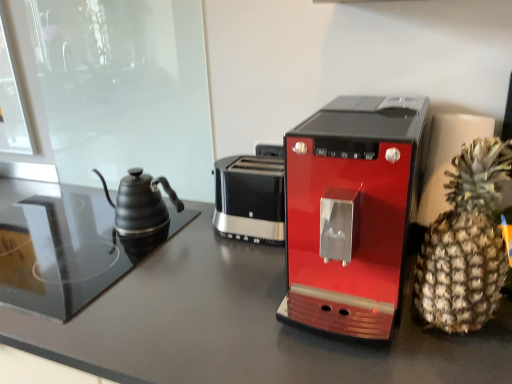
Describe the element at coordinates (251, 196) in the screenshot. I see `black plastic toaster at center` at that location.

What is the approximate height of brown spiky pineapple at right?

brown spiky pineapple at right is 32.21 centimeters in height.

The width and height of the screenshot is (512, 384). Describe the element at coordinates (465, 243) in the screenshot. I see `brown spiky pineapple at right` at that location.

Locate an element on the screen. The width and height of the screenshot is (512, 384). matte black table at center is located at coordinates (241, 327).

Where is `black plastic toaster at center`? black plastic toaster at center is located at coordinates (251, 196).

Considering the relative sizes of black plastic toaster at center and brown spiky pineapple at right in the image provided, is black plastic toaster at center shorter than brown spiky pineapple at right?

Yes, black plastic toaster at center is shorter than brown spiky pineapple at right.

From the image's perspective, which one is positioned lower, black plastic toaster at center or brown spiky pineapple at right?

From the image's view, brown spiky pineapple at right is below.

Which object is closer to the camera taking this photo, black plastic toaster at center or brown spiky pineapple at right?

brown spiky pineapple at right is closer to the camera.

From a real-world perspective, is black plastic toaster at center physically located above or below brown spiky pineapple at right?

In terms of real-world spatial position, black plastic toaster at center is below brown spiky pineapple at right.

Considering the sizes of objects matte black table at center and matte black kettle at left in the image provided, who is thinner, matte black table at center or matte black kettle at left?

matte black kettle at left.

From the image's perspective, relative to matte black kettle at left, is matte black table at center above or below?

From the image's perspective, matte black table at center appears below matte black kettle at left.

Which is more to the right, matte black table at center or matte black kettle at left?

From the viewer's perspective, matte black kettle at left appears more on the right side.

Can you tell me how much matte black table at center and matte black kettle at left differ in facing direction?

There is a 1.02-degree angle between the facing directions of matte black table at center and matte black kettle at left.

Is matte black table at center directly adjacent to shiny red coffee maker at center?

matte black table at center and shiny red coffee maker at center are clearly separated.

Considering the relative sizes of matte black table at center and shiny red coffee maker at center in the image provided, is matte black table at center wider than shiny red coffee maker at center?

Correct, the width of matte black table at center exceeds that of shiny red coffee maker at center.

Is matte black table at center positioned with its back to shiny red coffee maker at center?

No, matte black table at center is not facing away from shiny red coffee maker at center.

From the image's perspective, which is below, matte black table at center or shiny red coffee maker at center?

From the image's view, matte black table at center is below.

From a real-world perspective, does black plastic toaster at center sit lower than shiny red coffee maker at center?

Indeed, from a real-world perspective, black plastic toaster at center is positioned beneath shiny red coffee maker at center.

What are the coordinates of `toaster behind the shiny red coffee maker at center` in the screenshot? It's located at (251, 196).

In the image, is black plastic toaster at center positioned in front of or behind shiny red coffee maker at center?

Clearly, black plastic toaster at center is behind shiny red coffee maker at center.

Is shiny red coffee maker at center looking in the opposite direction of brown spiky pineapple at right?

No, brown spiky pineapple at right is not at the back of shiny red coffee maker at center.

Which of these two, shiny red coffee maker at center or brown spiky pineapple at right, is thinner?

Thinner between the two is brown spiky pineapple at right.

Would you say brown spiky pineapple at right is part of shiny red coffee maker at center's contents?

No, brown spiky pineapple at right is located outside of shiny red coffee maker at center.

Does matte black table at center come in front of black plastic toaster at center?

Yes.

From a real-world perspective, relative to black plastic toaster at center, is matte black table at center vertically above or below?

In terms of real-world spatial position, matte black table at center is below black plastic toaster at center.

Is matte black table at center to the left or to the right of black plastic toaster at center in the image?

matte black table at center is positioned on black plastic toaster at center's left side.

Where is `toaster above the matte black table at center (from the image's perspective)`? toaster above the matte black table at center (from the image's perspective) is located at coordinates (251, 196).

Where is `pineapple behind the matte black table at center`? The image size is (512, 384). pineapple behind the matte black table at center is located at coordinates (465, 243).

Considering the sizes of objects brown spiky pineapple at right and matte black table at center in the image provided, who is thinner, brown spiky pineapple at right or matte black table at center?

Thinner between the two is brown spiky pineapple at right.

Does point (490, 251) appear closer or farther from the camera than point (416, 346)?

Clearly, point (490, 251) is closer to the camera than point (416, 346).

How distant is brown spiky pineapple at right from matte black table at center?

brown spiky pineapple at right is 9.35 inches from matte black table at center.

At what (x,y) coordinates should I click in order to perform the action: click on toaster on the left of brown spiky pineapple at right. Please return your answer as a coordinate pair (x, y). The height and width of the screenshot is (384, 512). Looking at the image, I should click on (251, 196).

Find the location of a particular element. This screenshot has width=512, height=384. table directly beneath the matte black kettle at left (from a real-world perspective) is located at coordinates (241, 327).

When comparing their distances from shiny red coffee maker at center, does brown spiky pineapple at right or black plastic toaster at center seem closer?

brown spiky pineapple at right is closer to shiny red coffee maker at center.

From the image, which object appears to be farther from matte black table at center, brown spiky pineapple at right or shiny red coffee maker at center?

brown spiky pineapple at right is further to matte black table at center.

From the image, which object appears to be nearer to matte black kettle at left, black plastic toaster at center or matte black table at center?

Based on the image, black plastic toaster at center appears to be nearer to matte black kettle at left.

From the image, which object appears to be nearer to matte black kettle at left, shiny red coffee maker at center or matte black table at center?

matte black table at center is positioned closer to the anchor matte black kettle at left.

Based on their spatial positions, is matte black kettle at left or black plastic toaster at center closer to shiny red coffee maker at center?

Based on the image, black plastic toaster at center appears to be nearer to shiny red coffee maker at center.

Based on their spatial positions, is shiny red coffee maker at center or matte black kettle at left further from matte black table at center?

The object further to matte black table at center is matte black kettle at left.

Considering their positions, is matte black kettle at left positioned further to shiny red coffee maker at center than brown spiky pineapple at right?

The object further to shiny red coffee maker at center is matte black kettle at left.

Consider the image. Looking at the image, which one is located further to matte black kettle at left, brown spiky pineapple at right or black plastic toaster at center?

Based on the image, brown spiky pineapple at right appears to be further to matte black kettle at left.

Locate an element on the screen. This screenshot has height=384, width=512. kettle situated between matte black table at center and brown spiky pineapple at right from left to right is located at coordinates (141, 203).

The width and height of the screenshot is (512, 384). I want to click on toaster between matte black table at center and brown spiky pineapple at right from left to right, so click(251, 196).

Identify the location of toaster between shiny red coffee maker at center and matte black table at center vertically. Image resolution: width=512 pixels, height=384 pixels. (251, 196).

At what (x,y) coordinates should I click in order to perform the action: click on toaster between shiny red coffee maker at center and matte black kettle at left from front to back. Please return your answer as a coordinate pair (x, y). Looking at the image, I should click on (251, 196).